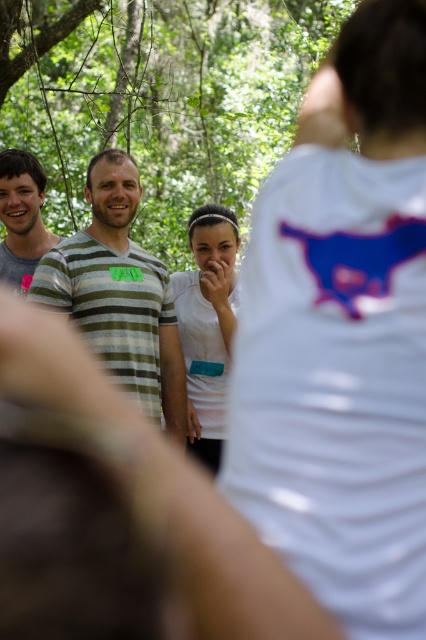
Question: Which object appears closest to the camera in this image?

Choices:
 (A) green leafy tree at upper center
 (B) white matte shirt at center
 (C) striped cotton shirt at left
 (D) green striped shirt at center

Answer: (B)

Question: Among these points, which one is nearest to the camera?

Choices:
 (A) (347, 515)
 (B) (187, 150)

Answer: (A)

Question: Does green leafy tree at upper center appear under striped cotton shirt at left?

Choices:
 (A) yes
 (B) no

Answer: (B)

Question: Is white matte shirt at center to the left of striped cotton shirt at left from the viewer's perspective?

Choices:
 (A) yes
 (B) no

Answer: (B)

Question: Is green leafy tree at upper center bigger than green striped shirt at center?

Choices:
 (A) yes
 (B) no

Answer: (B)

Question: Which point is closer to the camera?

Choices:
 (A) (19, 164)
 (B) (112, 83)
 (C) (351, 96)
 (D) (138, 204)

Answer: (C)